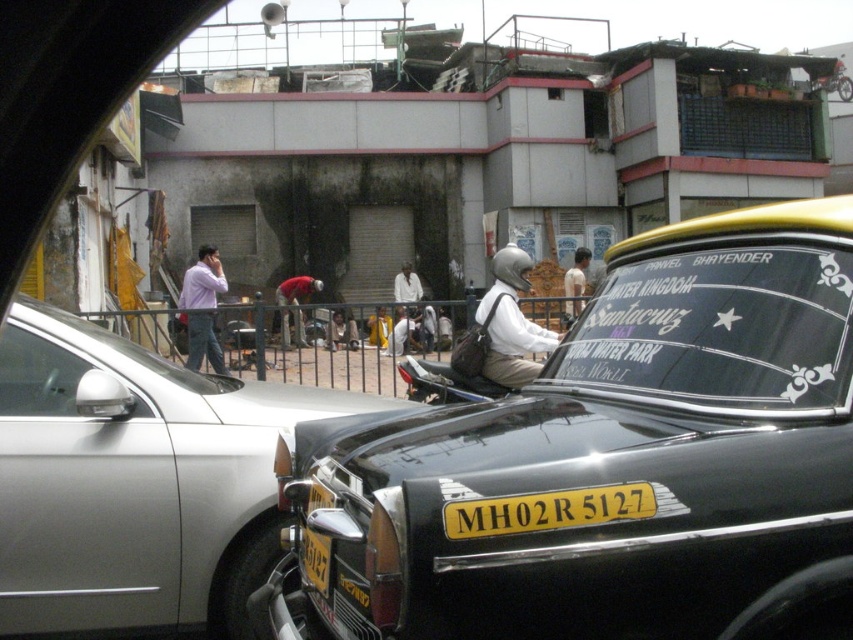
You are a fashion designer observing a scene with a person wearing a red fabric shirt at center and a light brown leather jacket at center. Which clothing item is positioned higher on the person?

The red fabric shirt at center is located above the light brown leather jacket at center, so the red fabric shirt at center is positioned higher on the person.

You are a delivery person who needs to choose a helmet for a motorcycle ride. You see two helmets in the scene, the matte white helmet at center and the white matte helmet at upper center. Which one is taller?

The matte white helmet at center is taller than the white matte helmet at upper center.

You are a delivery person needing to reach the red fabric shirt at center to deliver a package. The silver metallic car at center is blocking your path. Can you walk around it without getting too close? Please explain.

The silver metallic car at center and red fabric shirt at center are 45.26 feet apart. Since the distance between them is quite large, you can easily walk around the silver metallic car at center to reach the red fabric shirt at center without getting too close.